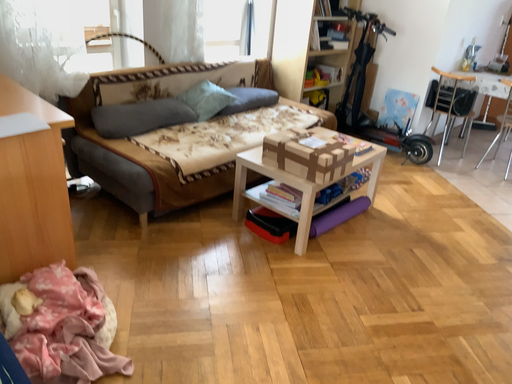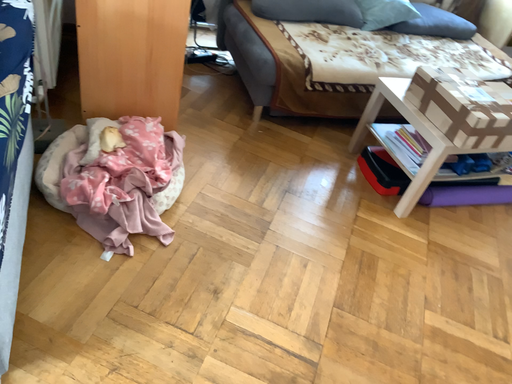
Question: Which way did the camera rotate in the video?

Choices:
 (A) rotated left
 (B) rotated right

Answer: (A)